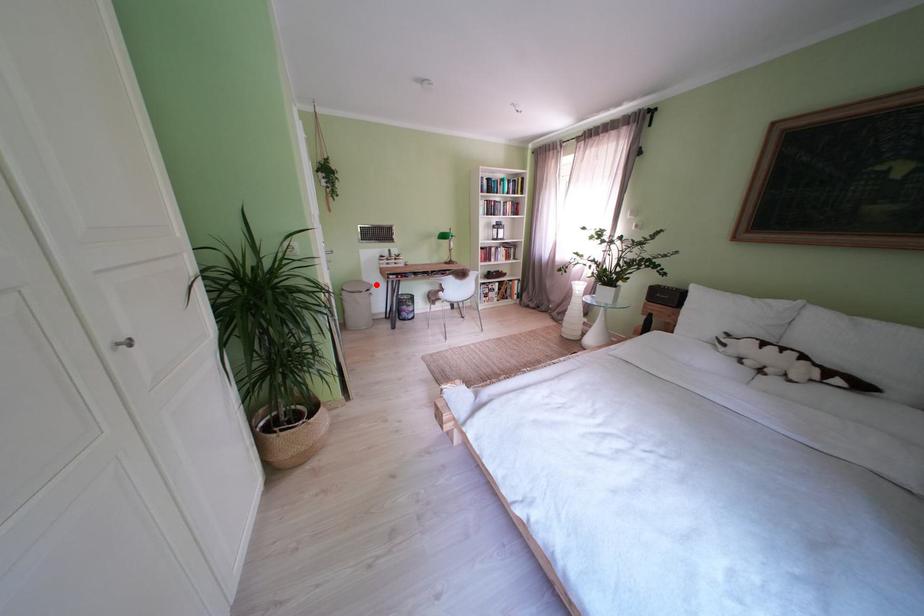
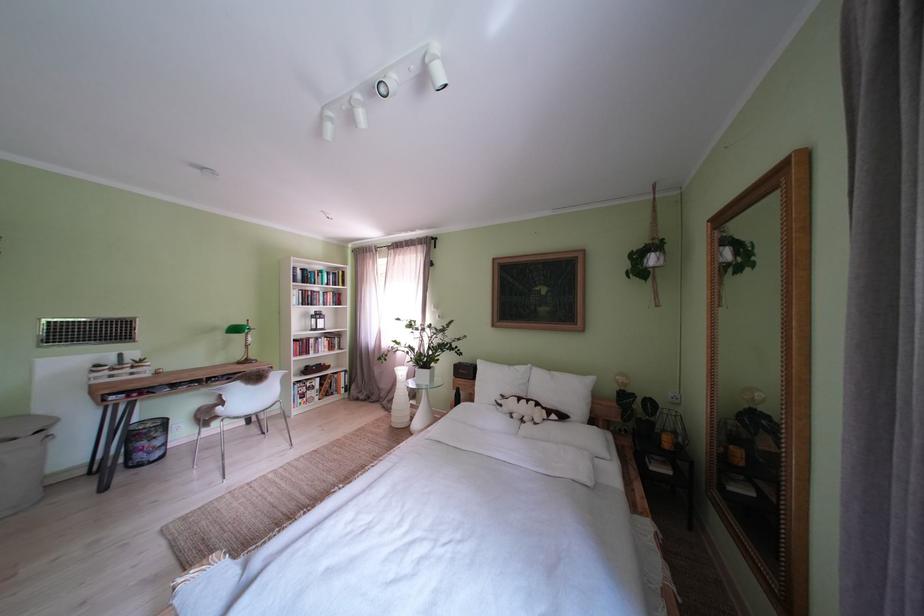
The point at the highlighted location is marked in the first image. Where is the corresponding point in the second image?

(52, 416)